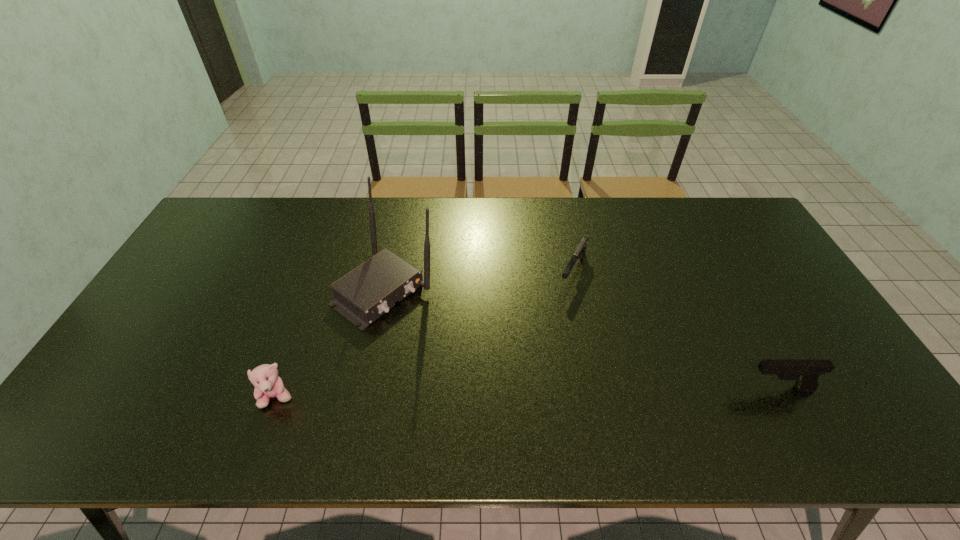
I want to click on vacant space in between the tallest object and the leftmost object, so click(331, 343).

I want to click on free spot between the teddy bear and the rightmost object, so click(x=528, y=393).

I want to click on vacant area between the third object from left to right and the tallest object, so tap(479, 280).

This screenshot has width=960, height=540. Identify the location of object that stands as the second closest to the second object from left to right. (581, 249).

At what (x,y) coordinates should I click in order to perform the action: click on object that is the third closest to the router. Please return your answer as a coordinate pair (x, y). This screenshot has height=540, width=960. Looking at the image, I should click on (806, 372).

Locate an element on the screen. This screenshot has width=960, height=540. blank area in the image that satisfies the following two spatial constraints: 1. on the front side of the pistol; 2. on the front-facing side of the router is located at coordinates (364, 389).

At what (x,y) coordinates should I click in order to perform the action: click on free space that satisfies the following two spatial constraints: 1. on the front side of the second object from left to right; 2. on the front-facing side of the rightmost object. Please return your answer as a coordinate pair (x, y). Looking at the image, I should click on (364, 389).

In order to click on blank space that satisfies the following two spatial constraints: 1. on the front side of the pistol; 2. on the front-facing side of the router in this screenshot , I will do `click(364, 389)`.